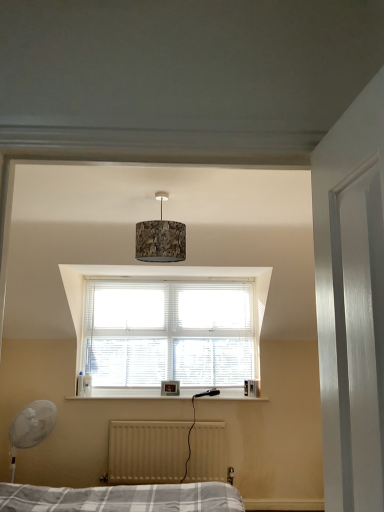
Image resolution: width=384 pixels, height=512 pixels. Identify the location of vacant area on top of textured cork lampshade at center (from a real-world perspective). (165, 193).